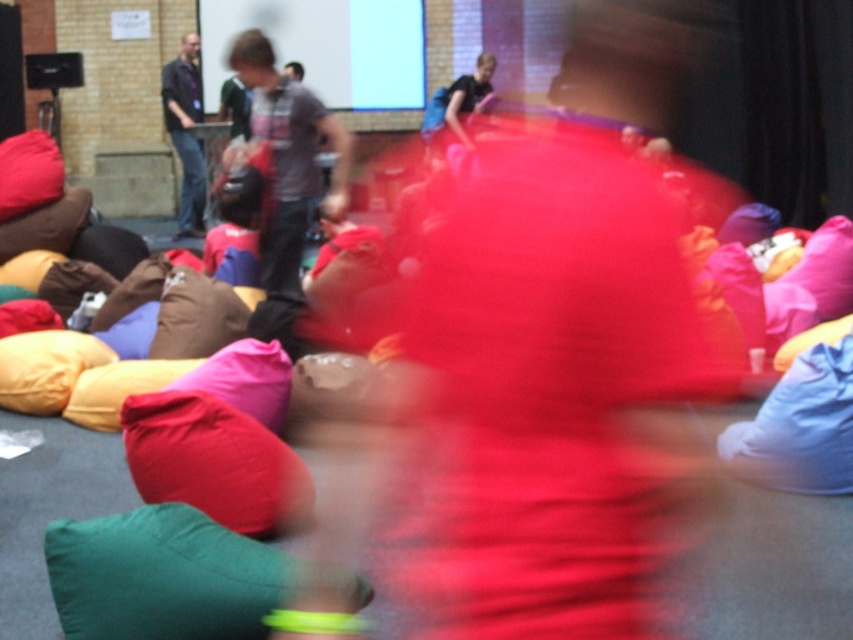
You are a photographer trying to capture a clear shot of the dark blue jeans at left and the matte pink beanbag at left from your current position. Given that your camera has a maximum focus range of 4 meters, will you be able to focus on both objects simultaneously?

The distance between the dark blue jeans at left and the matte pink beanbag at left is 4.05 meters, which exceeds the camera maximum focus range of 4 meters. Therefore, you cannot focus on both objects simultaneously.

You are trying to place a small decorative item on top of the dark blue jeans at left. Can the brown fabric pillow at center fit on top of it based on their sizes?

The brown fabric pillow at center is not as tall as dark blue jeans at left, so it can fit on top of the dark blue jeans at left since it is shorter in height.